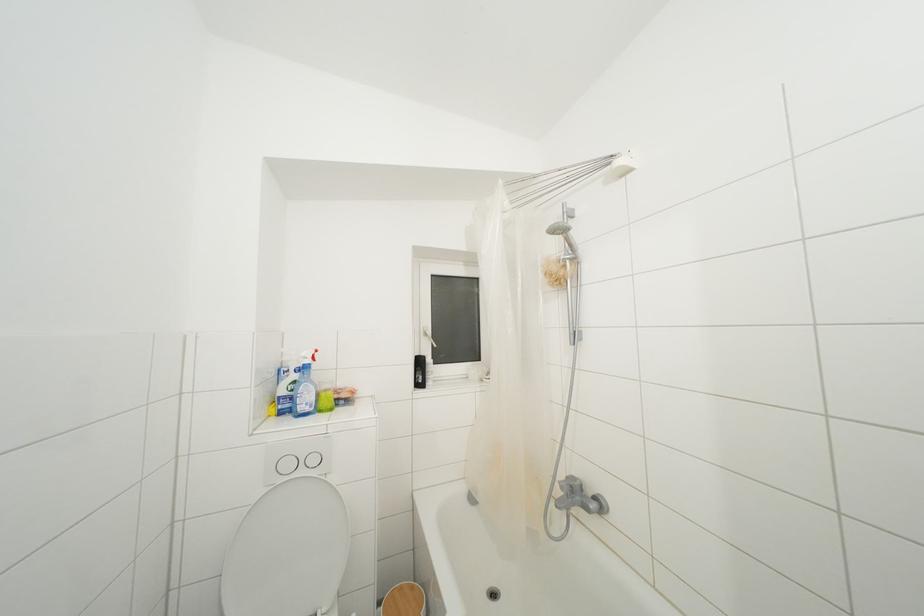
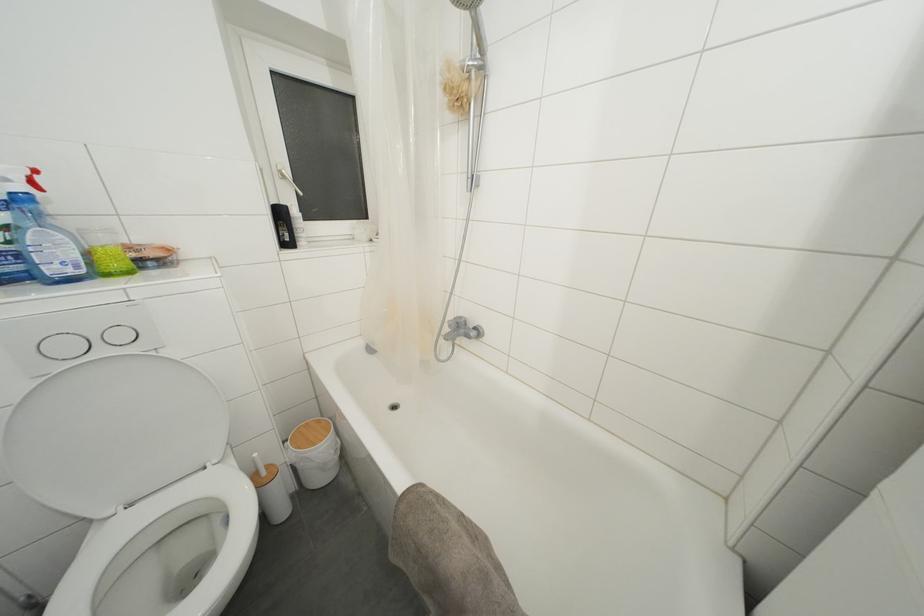
Looking at this image, the images are taken continuously from a first-person perspective. In which direction is your viewpoint rotating?

The camera's rotation is toward right-down.